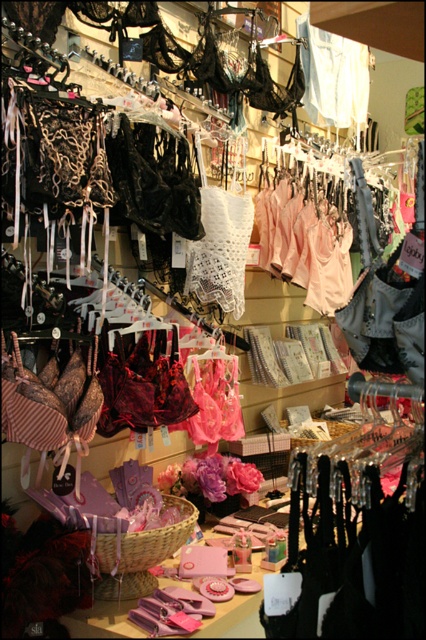
You are a customer trying to place the light beige lace lingerie at center into a storage box. The box can only accommodate items up to the width of the brown woven basket at center. Based on the items in the store, can the lingerie fit into the box?

The light beige lace lingerie at center might be wider than the brown woven basket at center, so it may not fit into the box designed for the basket width.

You are a customer in the lingerie store and want to pick up an item located at point (313,120) and another item at point (141,536). Which item should you reach for first if you want to grab the closer one first?

You should reach for the item at point (141,536) first because it is closer to you than the item at point (313,120), which is further away.